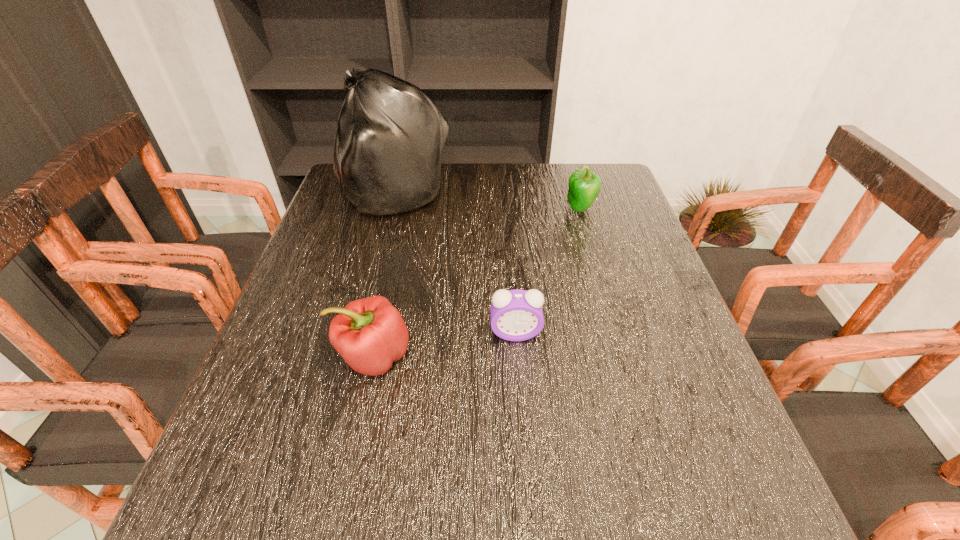
The image size is (960, 540). I want to click on vacant area that lies between the shortest object and the right bell pepper, so click(x=548, y=271).

The image size is (960, 540). I want to click on free space between the shortest object and the right bell pepper, so click(x=548, y=271).

Where is `vacant area that lies between the left bell pepper and the second object from right to left`? vacant area that lies between the left bell pepper and the second object from right to left is located at coordinates (444, 345).

Find the location of a particular element. blank region between the alarm clock and the farther bell pepper is located at coordinates (548, 271).

Image resolution: width=960 pixels, height=540 pixels. I want to click on vacant area that lies between the alarm clock and the plastic bag, so click(x=455, y=264).

At what (x,y) coordinates should I click in order to perform the action: click on free area in between the left bell pepper and the plastic bag. Please return your answer as a coordinate pair (x, y). Looking at the image, I should click on (384, 275).

The width and height of the screenshot is (960, 540). Find the location of `vacant space that is in between the rightmost object and the plastic bag`. vacant space that is in between the rightmost object and the plastic bag is located at coordinates (488, 201).

The image size is (960, 540). I want to click on unoccupied area between the left bell pepper and the tallest object, so pyautogui.click(x=384, y=275).

What are the coordinates of `free point between the shortest object and the tallest object` in the screenshot? It's located at (455, 264).

Where is `free spot between the left bell pepper and the plastic bag`? Image resolution: width=960 pixels, height=540 pixels. free spot between the left bell pepper and the plastic bag is located at coordinates (384, 275).